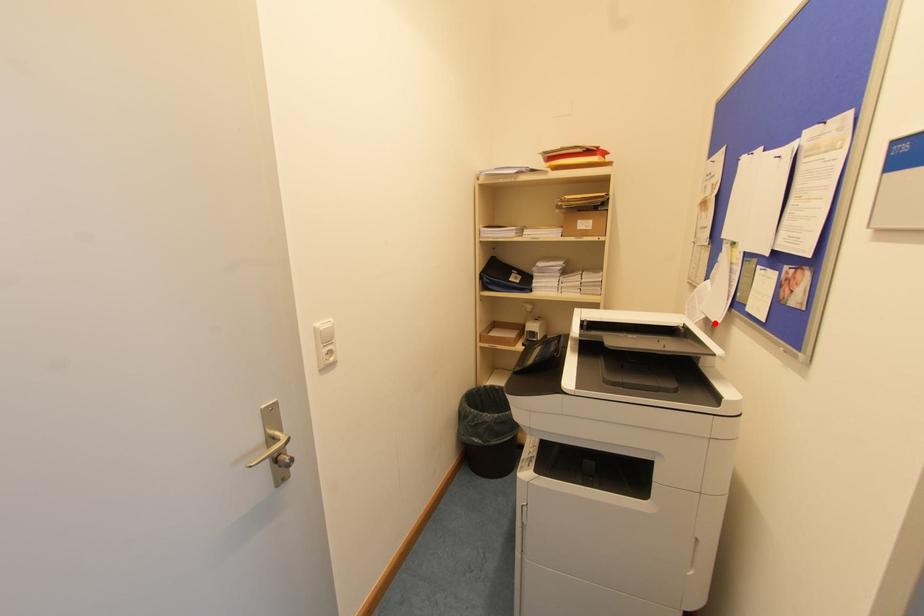
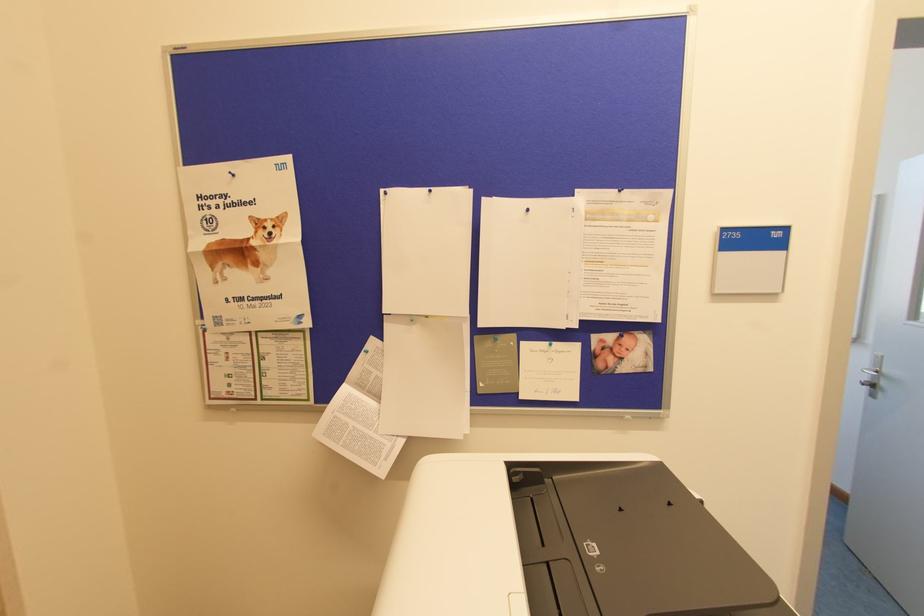
Locate, in the second image, the point that corresponds to the highlighted location in the first image.

(460, 438)